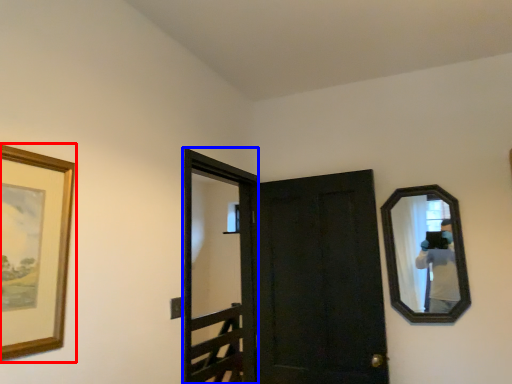
Question: Which of the following is the farthest to the observer, picture frame (highlighted by a red box) or screen door (highlighted by a blue box)?

Choices:
 (A) picture frame
 (B) screen door

Answer: (B)